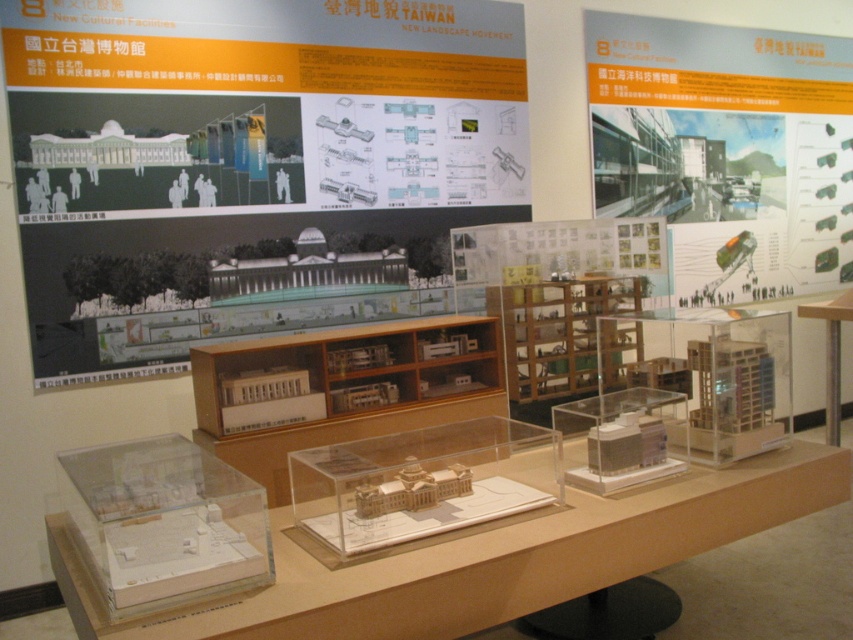
Is matte white building at upper right bigger than transparent plastic table at center?

Correct, matte white building at upper right is larger in size than transparent plastic table at center.

Between matte white building at upper right and transparent plastic table at center, which one appears on the left side from the viewer's perspective?

matte white building at upper right is more to the left.

Is point (729, 99) behind point (831, 316)?

Yes, point (729, 99) is farther from viewer.

Where is `matte white building at upper right`? The image size is (853, 640). matte white building at upper right is located at coordinates (726, 148).

What do you see at coordinates (489, 560) in the screenshot?
I see `clear acrylic table at center` at bounding box center [489, 560].

Is point (705, 486) closer to camera compared to point (479, 512)?

No.

I want to click on clear acrylic table at center, so click(489, 560).

Is matte white poster at upper center in front of clear acrylic table at center?

No.

The image size is (853, 640). Identify the location of matte white poster at upper center. (248, 164).

Where is `matte white poster at upper center`? This screenshot has height=640, width=853. matte white poster at upper center is located at coordinates (248, 164).